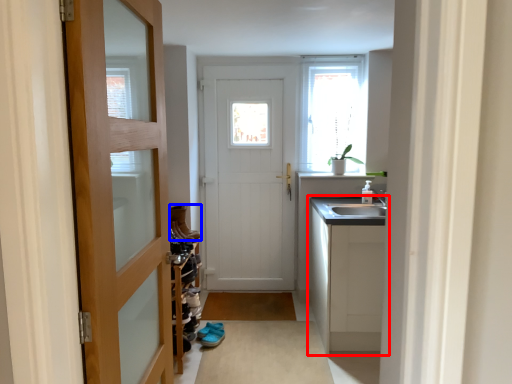
Question: Among these objects, which one is nearest to the camera, cabinetry (highlighted by a red box) or shoe (highlighted by a blue box)?

Choices:
 (A) cabinetry
 (B) shoe

Answer: (A)